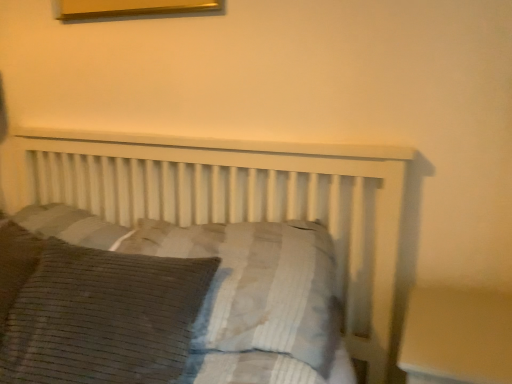
Question: From the image's perspective, is brown corduroy pillow at center, which is the 1th pillow in right-to-left order, above or below brown corduroy pillow at lower left, the 1th pillow in the left-to-right sequence?

Choices:
 (A) below
 (B) above

Answer: (B)

Question: Considering their positions, is brown corduroy pillow at center, which is the 1th pillow in right-to-left order, located in front of or behind brown corduroy pillow at lower left, marked as the 2th pillow in a right-to-left arrangement?

Choices:
 (A) behind
 (B) front

Answer: (A)

Question: Is brown corduroy pillow at center, the second pillow positioned from the left, spatially inside brown corduroy pillow at lower left, the 1th pillow in the left-to-right sequence, or outside of it?

Choices:
 (A) inside
 (B) outside

Answer: (B)

Question: From a real-world perspective, relative to brown corduroy pillow at center, which is the 1th pillow in right-to-left order, is brown corduroy pillow at lower left, marked as the 2th pillow in a right-to-left arrangement, vertically above or below?

Choices:
 (A) below
 (B) above

Answer: (A)

Question: Based on their sizes in the image, would you say brown corduroy pillow at lower left, marked as the 2th pillow in a right-to-left arrangement, is bigger or smaller than brown corduroy pillow at center, the second pillow positioned from the left?

Choices:
 (A) small
 (B) big

Answer: (A)

Question: From the image's perspective, is brown corduroy pillow at lower left, marked as the 2th pillow in a right-to-left arrangement, positioned above or below brown corduroy pillow at center, the second pillow positioned from the left?

Choices:
 (A) above
 (B) below

Answer: (B)

Question: In the image, is brown corduroy pillow at lower left, the 1th pillow in the left-to-right sequence, positioned in front of or behind brown corduroy pillow at center, which is the 1th pillow in right-to-left order?

Choices:
 (A) front
 (B) behind

Answer: (A)